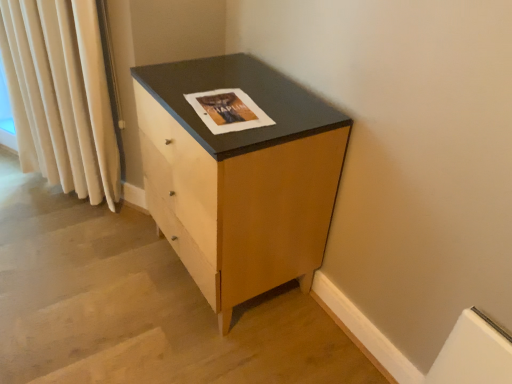
Question: Does matte wood chest of drawers at center have a lesser height compared to cream velvet curtain at left?

Choices:
 (A) yes
 (B) no

Answer: (A)

Question: Does matte wood chest of drawers at center contain cream velvet curtain at left?

Choices:
 (A) yes
 (B) no

Answer: (B)

Question: From the image's perspective, is matte wood chest of drawers at center over cream velvet curtain at left?

Choices:
 (A) no
 (B) yes

Answer: (A)

Question: From a real-world perspective, is matte wood chest of drawers at center beneath cream velvet curtain at left?

Choices:
 (A) yes
 (B) no

Answer: (A)

Question: Could you tell me if matte wood chest of drawers at center is facing cream velvet curtain at left?

Choices:
 (A) no
 (B) yes

Answer: (A)

Question: Does matte wood chest of drawers at center have a larger size compared to cream velvet curtain at left?

Choices:
 (A) no
 (B) yes

Answer: (B)

Question: Does cream velvet curtain at left have a lesser width compared to matte wood chest of drawers at center?

Choices:
 (A) no
 (B) yes

Answer: (B)

Question: Is cream velvet curtain at left bigger than matte wood chest of drawers at center?

Choices:
 (A) no
 (B) yes

Answer: (A)

Question: Is cream velvet curtain at left facing towards matte wood chest of drawers at center?

Choices:
 (A) yes
 (B) no

Answer: (B)

Question: From the image's perspective, does cream velvet curtain at left appear lower than matte wood chest of drawers at center?

Choices:
 (A) yes
 (B) no

Answer: (B)

Question: Does cream velvet curtain at left appear on the left side of matte wood chest of drawers at center?

Choices:
 (A) no
 (B) yes

Answer: (B)

Question: Is cream velvet curtain at left taller than matte wood chest of drawers at center?

Choices:
 (A) yes
 (B) no

Answer: (A)

Question: Can you confirm if matte paper magazine at center is shorter than cream velvet curtain at left?

Choices:
 (A) no
 (B) yes

Answer: (B)